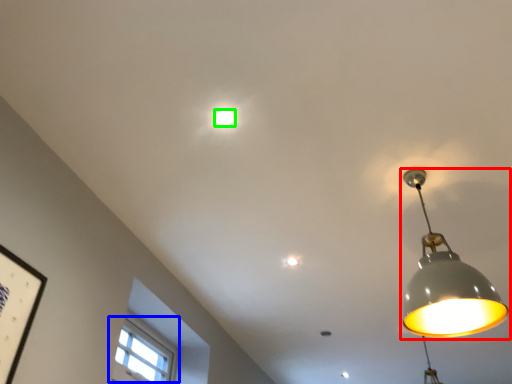
Question: Considering the real-world distances, which object is farthest from lamp (highlighted by a red box)? window (highlighted by a blue box) or lamp (highlighted by a green box)?

Choices:
 (A) window
 (B) lamp

Answer: (A)